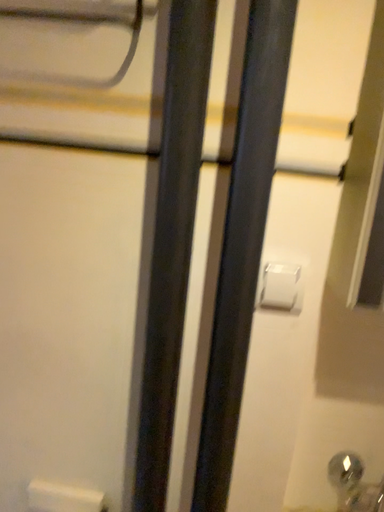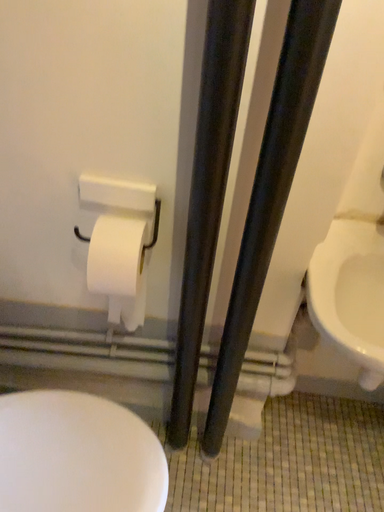
Question: How did the camera likely rotate when shooting the video?

Choices:
 (A) rotated upward
 (B) rotated downward

Answer: (B)